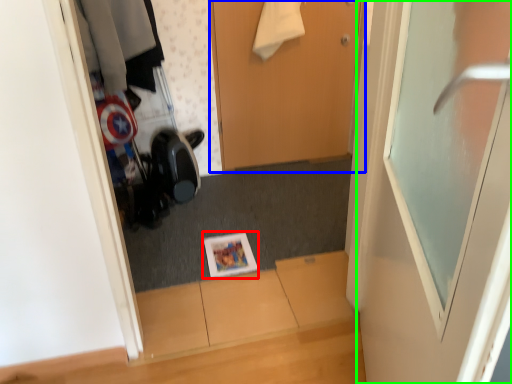
Question: Estimate the real-world distances between objects in this image. Which object is farther from magazine (highlighted by a red box), door (highlighted by a blue box) or door (highlighted by a green box)?

Choices:
 (A) door
 (B) door

Answer: (B)